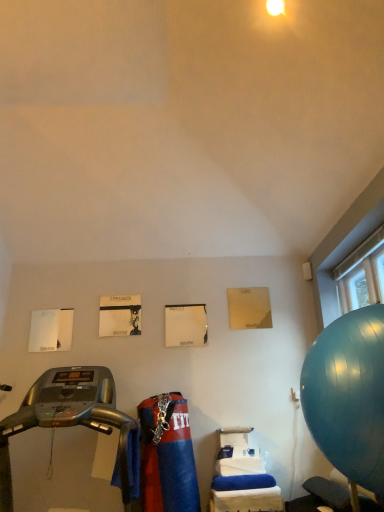
Question: Does silver metallic treadmill at left lie behind blue rubber ball at right?

Choices:
 (A) no
 (B) yes

Answer: (A)

Question: Is silver metallic treadmill at left to the left of blue rubber ball at right from the viewer's perspective?

Choices:
 (A) no
 (B) yes

Answer: (B)

Question: Considering the relative positions of silver metallic treadmill at left and blue rubber ball at right in the image provided, is silver metallic treadmill at left to the right of blue rubber ball at right from the viewer's perspective?

Choices:
 (A) no
 (B) yes

Answer: (A)

Question: Does silver metallic treadmill at left have a greater height compared to blue rubber ball at right?

Choices:
 (A) no
 (B) yes

Answer: (B)

Question: Does silver metallic treadmill at left have a lesser width compared to blue rubber ball at right?

Choices:
 (A) no
 (B) yes

Answer: (A)

Question: From the image's perspective, is silver metallic treadmill at left on blue rubber ball at right?

Choices:
 (A) yes
 (B) no

Answer: (B)

Question: Can you confirm if blue rubber ball at right is smaller than silver metallic treadmill at left?

Choices:
 (A) no
 (B) yes

Answer: (B)

Question: Is blue rubber ball at right facing towards silver metallic treadmill at left?

Choices:
 (A) yes
 (B) no

Answer: (A)

Question: Can you confirm if blue rubber ball at right is shorter than silver metallic treadmill at left?

Choices:
 (A) no
 (B) yes

Answer: (B)

Question: Does blue rubber ball at right have a greater height compared to silver metallic treadmill at left?

Choices:
 (A) no
 (B) yes

Answer: (A)

Question: Does blue rubber ball at right appear on the left side of silver metallic treadmill at left?

Choices:
 (A) no
 (B) yes

Answer: (A)

Question: Is blue rubber ball at right far from silver metallic treadmill at left?

Choices:
 (A) no
 (B) yes

Answer: (B)

Question: From a real-world perspective, is blue rubber ball at right physically located above or below silver metallic treadmill at left?

Choices:
 (A) above
 (B) below

Answer: (A)